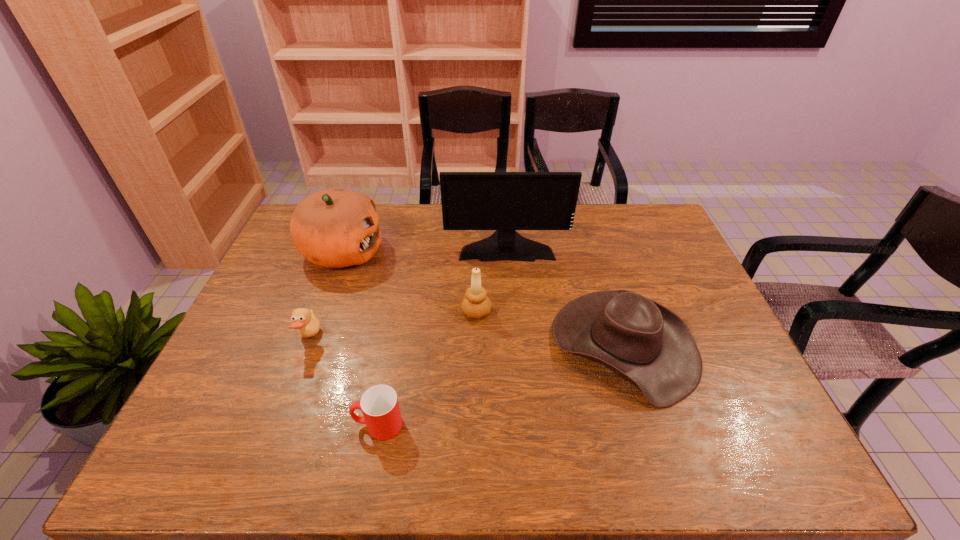
Image resolution: width=960 pixels, height=540 pixels. Identify the location of free space that satisfies the following two spatial constraints: 1. on the face of the pumpkin; 2. on the side of the third object from left to right with the handle. tap(278, 425).

The image size is (960, 540). I want to click on free point that satisfies the following two spatial constraints: 1. on the screen side of the monitor; 2. on the right side of the cowboy hat, so click(514, 346).

Find the location of a particular element. The width and height of the screenshot is (960, 540). vacant space that satisfies the following two spatial constraints: 1. on the side of the nearest object with the handle; 2. on the right side of the fourth shortest object is located at coordinates (399, 312).

At what (x,y) coordinates should I click in order to perform the action: click on free space that satisfies the following two spatial constraints: 1. on the face of the second tallest object; 2. on the side of the third object from left to right with the handle. Please return your answer as a coordinate pair (x, y). Looking at the image, I should click on (278, 425).

Image resolution: width=960 pixels, height=540 pixels. I want to click on vacant space that satisfies the following two spatial constraints: 1. on the screen side of the monitor; 2. on the left side of the cowboy hat, so click(514, 346).

Find the location of a particular element. The width and height of the screenshot is (960, 540). vacant region that satisfies the following two spatial constraints: 1. on the side of the nearest object with the handle; 2. on the back side of the candle_holder is located at coordinates (399, 312).

Identify the location of vacant point that satisfies the following two spatial constraints: 1. on the side of the cup with the handle; 2. on the beak of the duck. The height and width of the screenshot is (540, 960). (395, 338).